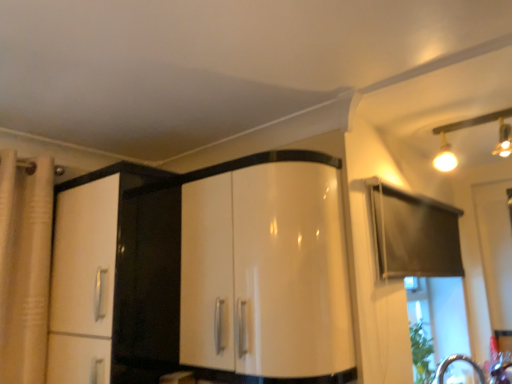
Question: Is glossy white cabinet at center spatially inside matte gold track lights at upper right, or outside of it?

Choices:
 (A) outside
 (B) inside

Answer: (A)

Question: Considering the positions of glossy white cabinet at center and matte gold track lights at upper right in the image, is glossy white cabinet at center bigger or smaller than matte gold track lights at upper right?

Choices:
 (A) big
 (B) small

Answer: (A)

Question: From the image's perspective, is glossy white cabinet at center above or below matte gold track lights at upper right?

Choices:
 (A) below
 (B) above

Answer: (A)

Question: Considering the positions of matte gold track lights at upper right and glossy white cabinet at center in the image, is matte gold track lights at upper right taller or shorter than glossy white cabinet at center?

Choices:
 (A) tall
 (B) short

Answer: (B)

Question: Considering the positions of matte gold track lights at upper right and glossy white cabinet at center in the image, is matte gold track lights at upper right bigger or smaller than glossy white cabinet at center?

Choices:
 (A) big
 (B) small

Answer: (B)

Question: Based on their positions, is matte gold track lights at upper right located to the left or right of glossy white cabinet at center?

Choices:
 (A) right
 (B) left

Answer: (A)

Question: From a real-world perspective, is matte gold track lights at upper right physically located above or below glossy white cabinet at center?

Choices:
 (A) above
 (B) below

Answer: (A)